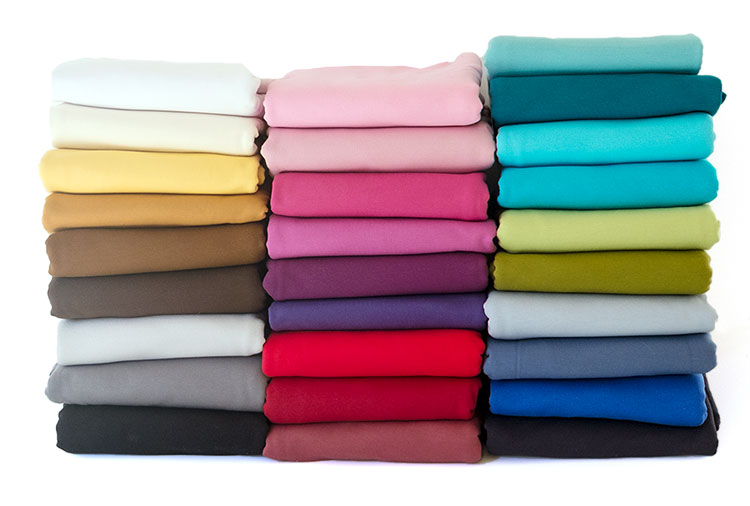
In order to click on pink fabric in this screenshot , I will do (x=382, y=105), (x=385, y=150), (x=397, y=193), (x=386, y=244).